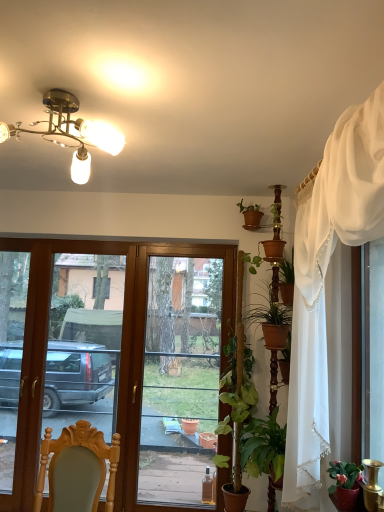
Question: Is green leafy plant at center-right closer to the viewer compared to matte red pot at lower right, the 2th houseplant in the bottom-to-top sequence?

Choices:
 (A) yes
 (B) no

Answer: (B)

Question: Can matte red pot at lower right, placed as the 3th houseplant when sorted from back to front, be found inside green leafy plant at center-right?

Choices:
 (A) no
 (B) yes

Answer: (A)

Question: From a real-world perspective, does green leafy plant at center-right sit lower than matte red pot at lower right, which is the 2th houseplant from top to bottom?

Choices:
 (A) no
 (B) yes

Answer: (A)

Question: Does green leafy plant at center-right have a lesser height compared to matte red pot at lower right, which is the 3th houseplant from left to right?

Choices:
 (A) yes
 (B) no

Answer: (B)

Question: Is green leafy plant at center-right to the left of matte red pot at lower right, which is the 1th houseplant from front to back, from the viewer's perspective?

Choices:
 (A) no
 (B) yes

Answer: (B)

Question: Based on their sizes in the image, would you say wooden chair at lower left is bigger or smaller than green leafy plant at center-right?

Choices:
 (A) small
 (B) big

Answer: (B)

Question: Considering the positions of wooden chair at lower left and green leafy plant at center-right in the image, is wooden chair at lower left wider or thinner than green leafy plant at center-right?

Choices:
 (A) wide
 (B) thin

Answer: (A)

Question: Choose the correct answer: Is wooden chair at lower left inside green leafy plant at center-right or outside it?

Choices:
 (A) outside
 (B) inside

Answer: (A)

Question: Considering their positions, is wooden chair at lower left located in front of or behind green leafy plant at center-right?

Choices:
 (A) front
 (B) behind

Answer: (A)

Question: From a real-world perspective, is wooden chair at lower left physically located above or below green matte plant at right, acting as the second houseplant starting from the front?

Choices:
 (A) above
 (B) below

Answer: (A)

Question: Based on their sizes in the image, would you say wooden chair at lower left is bigger or smaller than green matte plant at right, the 3th houseplant in the top-to-bottom sequence?

Choices:
 (A) small
 (B) big

Answer: (B)

Question: Visually, is wooden chair at lower left positioned to the left or to the right of green matte plant at right, the 2th houseplant when ordered from back to front?

Choices:
 (A) right
 (B) left

Answer: (B)

Question: Is wooden chair at lower left in front of or behind green matte plant at right, placed as the third houseplant when sorted from right to left, in the image?

Choices:
 (A) behind
 (B) front

Answer: (B)

Question: From the image's perspective, is transparent glass door at center positioned above or below green leafy plant at center-right?

Choices:
 (A) above
 (B) below

Answer: (B)

Question: Considering the positions of transparent glass door at center and green leafy plant at center-right in the image, is transparent glass door at center wider or thinner than green leafy plant at center-right?

Choices:
 (A) wide
 (B) thin

Answer: (B)